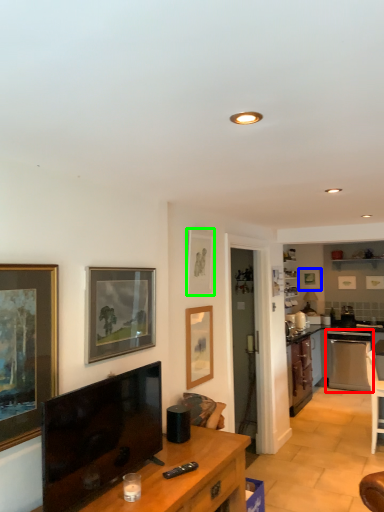
Question: Which object is positioned closest to dish washer (highlighted by a red box)? Select from picture frame (highlighted by a blue box) and picture frame (highlighted by a green box).

Choices:
 (A) picture frame
 (B) picture frame

Answer: (A)